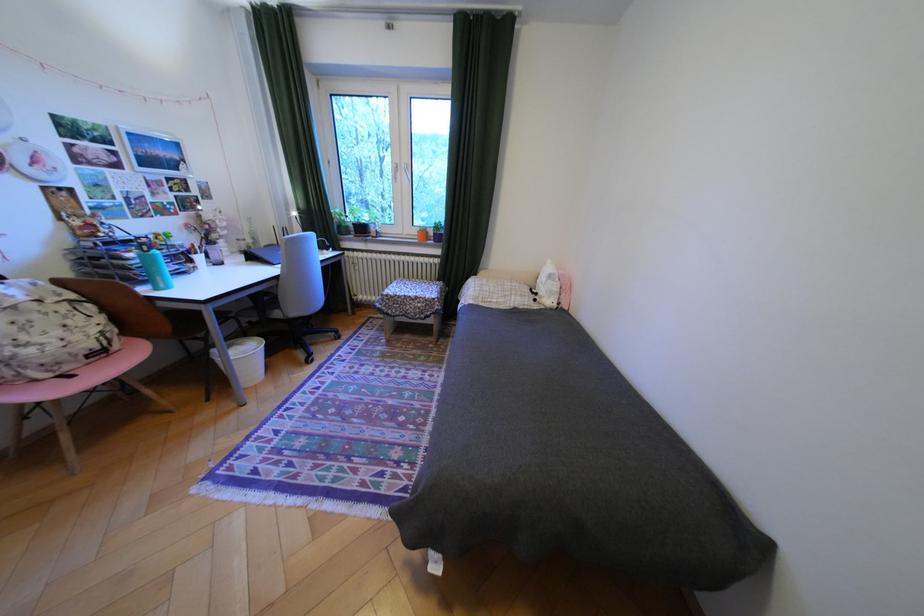
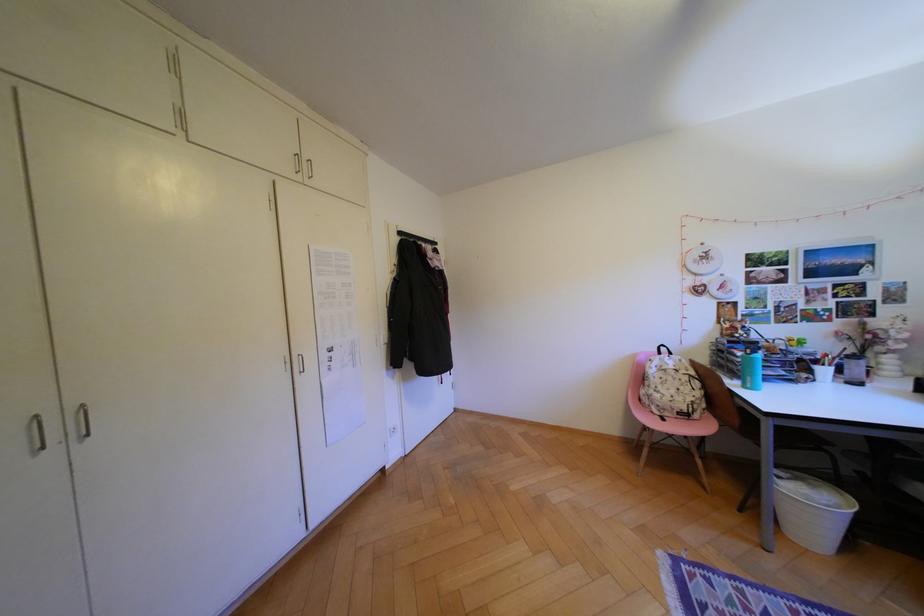
Question: Based on the continuous images, in which direction is the camera rotating? Reply with the corresponding letter.

Choices:
 (A) Left
 (B) Right
 (C) Up
 (D) Down

Answer: (A)